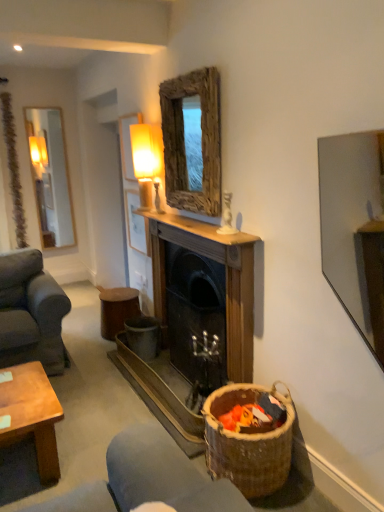
Where is `free space that is to the left of wooden stool at center`? Image resolution: width=384 pixels, height=512 pixels. free space that is to the left of wooden stool at center is located at coordinates (81, 335).